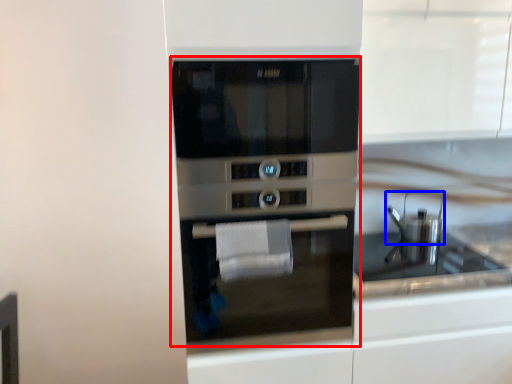
Question: Which object appears farthest to the camera in this image, oven (highlighted by a red box) or appliance (highlighted by a blue box)?

Choices:
 (A) oven
 (B) appliance

Answer: (B)